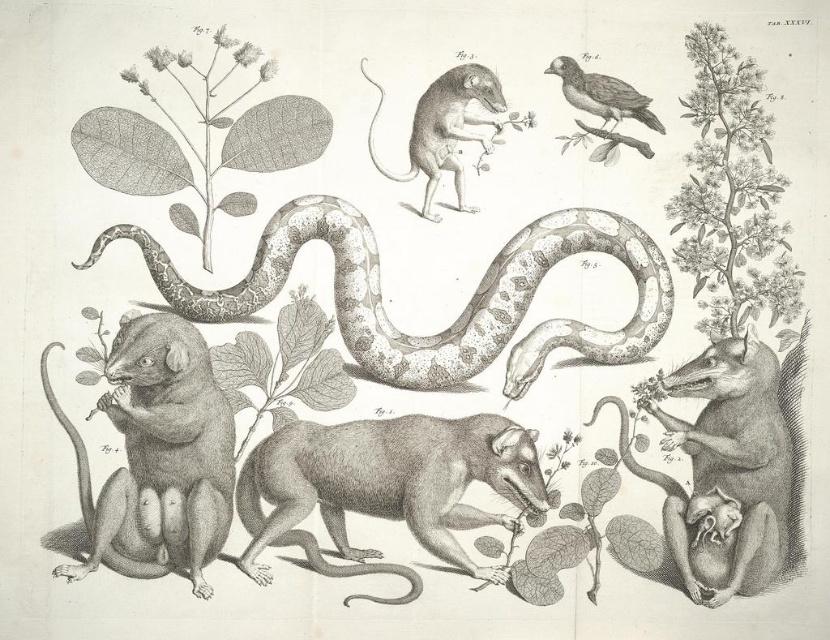
In the scene shown: You are a researcher standing at a distance of 10 meters from the speckled gray snake at center. You need to take a closer look at the snake without disturbing it. Can you move forward 1 meter to get a better view?

The distance between you and the speckled gray snake at center is currently 10 meters. Moving forward 1 meter would bring you to 9 meters away. The speckled gray snake at center is 10.66 meters away from the camera, so moving forward 1 meter would still keep you within the 10.66 meter distance, allowing you to approach closer without exceeding the original distance.

What are the exact coordinates of the brown furry rodent at lower left in the image?

The brown furry rodent at lower left is located at coordinates (164, 452).

You are a biologist examining the illustration. You notice the speckled gray snake at center and the smooth gray mouse at center. Which animal is positioned to the right in the image?

The smooth gray mouse at center is positioned to the right of the speckled gray snake at center.